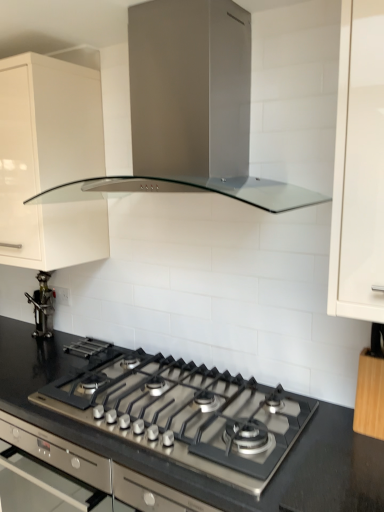
At what (x,y) coordinates should I click in order to perform the action: click on free spot above black granite countertop at center (from a real-world perspective). Please return your answer as a coordinate pair (x, y). Looking at the image, I should click on tap(157, 387).